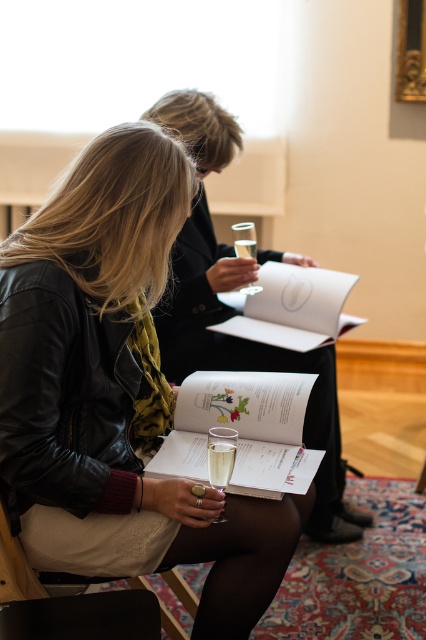
Question: Does translucent glass at lower center have a larger size compared to clear glass at center?

Choices:
 (A) yes
 (B) no

Answer: (B)

Question: Can you confirm if leather jacket at center is positioned to the right of translucent glass at lower center?

Choices:
 (A) yes
 (B) no

Answer: (B)

Question: Which of the following is the farthest from the observer?

Choices:
 (A) translucent glass at lower center
 (B) clear glass wine glass at lower center

Answer: (B)

Question: Which object appears closest to the camera in this image?

Choices:
 (A) leather jacket at center
 (B) clear glass wine glass at lower center

Answer: (A)

Question: Does leather jacket at center appear over clear glass at center?

Choices:
 (A) yes
 (B) no

Answer: (B)

Question: Which object appears closest to the camera in this image?

Choices:
 (A) clear glass at center
 (B) leather jacket at center
 (C) translucent glass at lower center
 (D) clear glass wine glass at lower center

Answer: (B)